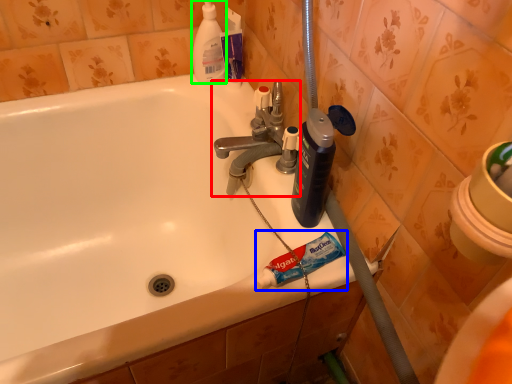
Question: Based on their relative distances, which object is nearer to tap (highlighted by a red box)? Choose from toothpaste (highlighted by a blue box) and cleaning product (highlighted by a green box).

Choices:
 (A) toothpaste
 (B) cleaning product

Answer: (B)